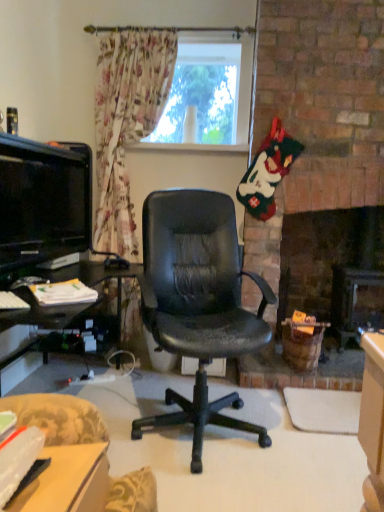
Question: Is matte plastic desk at lower left to the right of transparent glass window at upper center from the viewer's perspective?

Choices:
 (A) no
 (B) yes

Answer: (A)

Question: Is matte plastic desk at lower left not inside transparent glass window at upper center?

Choices:
 (A) no
 (B) yes

Answer: (B)

Question: Does matte plastic desk at lower left come behind transparent glass window at upper center?

Choices:
 (A) no
 (B) yes

Answer: (A)

Question: Is matte plastic desk at lower left looking in the opposite direction of transparent glass window at upper center?

Choices:
 (A) yes
 (B) no

Answer: (B)

Question: Is matte plastic desk at lower left touching transparent glass window at upper center?

Choices:
 (A) yes
 (B) no

Answer: (B)

Question: Is matte plastic desk at lower left wider or thinner than transparent glass window at upper center?

Choices:
 (A) wide
 (B) thin

Answer: (A)

Question: From a real-world perspective, relative to transparent glass window at upper center, is matte plastic desk at lower left vertically above or below?

Choices:
 (A) above
 (B) below

Answer: (B)

Question: Choose the correct answer: Is matte plastic desk at lower left inside transparent glass window at upper center or outside it?

Choices:
 (A) inside
 (B) outside

Answer: (B)

Question: In terms of size, does matte plastic desk at lower left appear bigger or smaller than transparent glass window at upper center?

Choices:
 (A) big
 (B) small

Answer: (B)

Question: In terms of size, does matte plastic desk at lower left appear bigger or smaller than matte black tv at left?

Choices:
 (A) big
 (B) small

Answer: (B)

Question: In the image, is matte plastic desk at lower left positioned in front of or behind matte black tv at left?

Choices:
 (A) behind
 (B) front

Answer: (B)

Question: Considering the positions of point (77, 446) and point (13, 240), is point (77, 446) closer or farther from the camera than point (13, 240)?

Choices:
 (A) farther
 (B) closer

Answer: (B)

Question: Is matte plastic desk at lower left situated inside matte black tv at left or outside?

Choices:
 (A) inside
 (B) outside

Answer: (B)

Question: From the image's perspective, relative to matte plastic desk at lower left, is matte black tv at left above or below?

Choices:
 (A) above
 (B) below

Answer: (A)

Question: Is matte black tv at left in front of or behind matte plastic desk at lower left in the image?

Choices:
 (A) behind
 (B) front

Answer: (A)